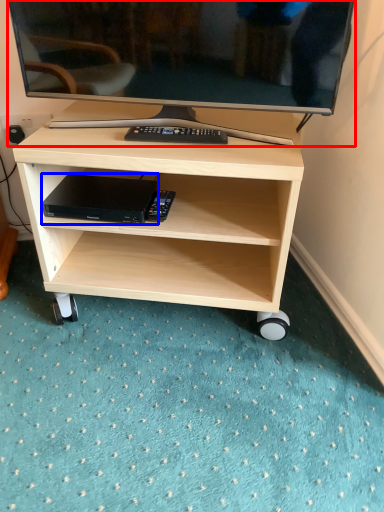
Question: Which point is further to the camera, television (highlighted by a red box) or computer (highlighted by a blue box)?

Choices:
 (A) television
 (B) computer

Answer: (B)